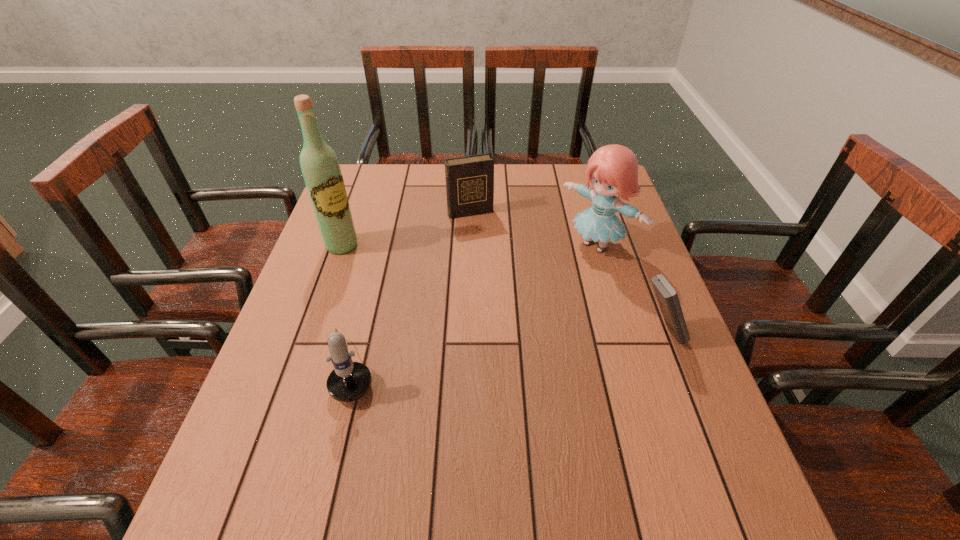
Find the location of a particular element. The height and width of the screenshot is (540, 960). vacant area that lies between the third object from right to left and the fourth shortest object is located at coordinates (534, 228).

Find the location of a particular element. vacant space that's between the wine bottle and the diary is located at coordinates (406, 228).

Where is `free spot between the farthest object and the second tallest object`? free spot between the farthest object and the second tallest object is located at coordinates (534, 228).

I want to click on blank region between the fourth object from right to left and the fourth shortest object, so click(x=474, y=305).

Where is `free space between the calculator and the farthest object`? free space between the calculator and the farthest object is located at coordinates (565, 272).

Locate an element on the screen. free spot between the tallest object and the calculator is located at coordinates (501, 289).

I want to click on object that can be found as the closest to the microphone, so click(x=320, y=167).

Where is `object that is the closest to the farthest object`? The image size is (960, 540). object that is the closest to the farthest object is located at coordinates (612, 169).

The height and width of the screenshot is (540, 960). I want to click on free spot that satisfies the following two spatial constraints: 1. on the front side of the fourth shortest object; 2. on the left side of the diary, so click(469, 245).

At what (x,y) coordinates should I click in order to perform the action: click on vacant space that satisfies the following two spatial constraints: 1. on the back side of the second tallest object; 2. on the right side of the tallest object. Please return your answer as a coordinate pair (x, y). This screenshot has height=540, width=960. Looking at the image, I should click on (343, 245).